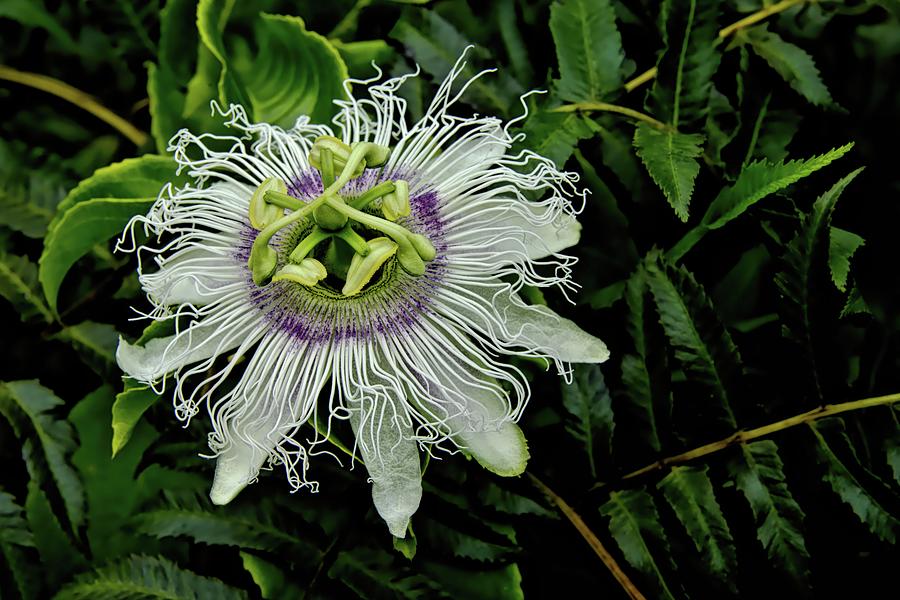
The image size is (900, 600). What are the coordinates of `corner` in the screenshot? It's located at (861, 102).